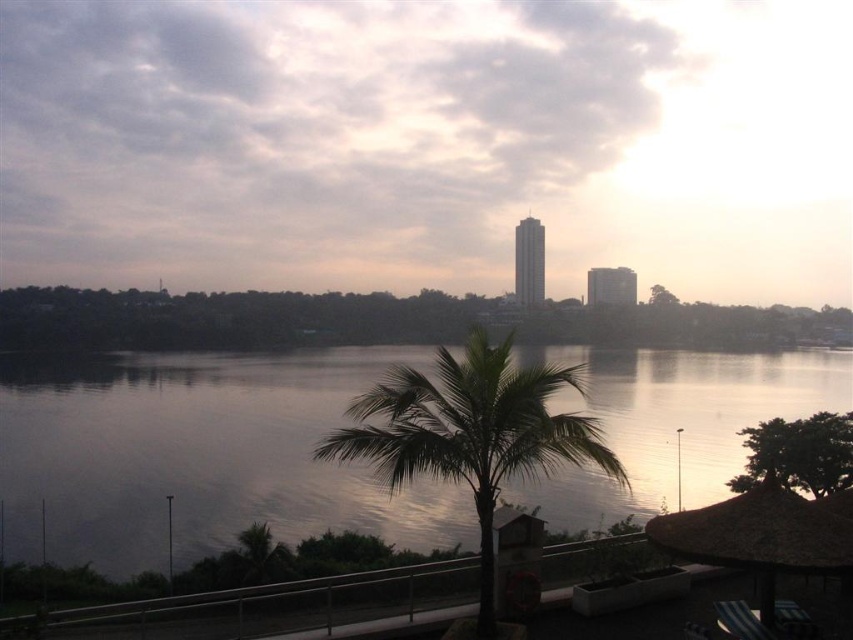
Question: Which point appears closest to the camera in this image?

Choices:
 (A) (700, 406)
 (B) (519, 458)

Answer: (B)

Question: Which of the following is the closest to the observer?

Choices:
 (A) (383, 468)
 (B) (57, 476)

Answer: (A)

Question: Is silvery reflective water at center below green leafy palm tree at center?

Choices:
 (A) no
 (B) yes

Answer: (A)

Question: Can you confirm if silvery reflective water at center is positioned above green leafy palm tree at center?

Choices:
 (A) yes
 (B) no

Answer: (A)

Question: Does silvery reflective water at center appear under green leafy palm tree at center?

Choices:
 (A) yes
 (B) no

Answer: (B)